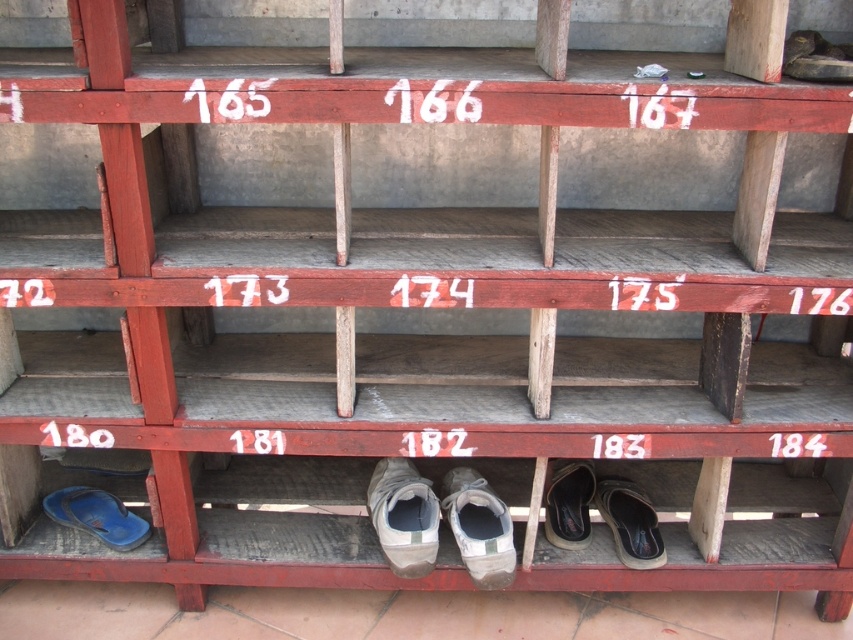
Does white fabric shoe at lower center have a larger size compared to black leather shoe at lower center?

Yes, white fabric shoe at lower center is bigger than black leather shoe at lower center.

Based on the photo, is white fabric shoe at lower center further to camera compared to black leather shoe at lower center?

No, white fabric shoe at lower center is closer to the viewer.

Is point (416, 563) positioned behind point (579, 496)?

No, it is in front of (579, 496).

Find the location of a particular element. white fabric shoe at lower center is located at coordinates (403, 516).

Does white fabric shoe at lower center appear on the left side of leather brown shoe at lower right?

Indeed, white fabric shoe at lower center is positioned on the left side of leather brown shoe at lower right.

Is point (428, 540) farther from viewer compared to point (613, 499)?

That is False.

Describe the element at coordinates (403, 516) in the screenshot. I see `white fabric shoe at lower center` at that location.

What are the coordinates of `white fabric shoe at lower center` in the screenshot? It's located at (403, 516).

Does blue rubber flip-flop at lower left appear under black leather shoe at lower center?

Indeed, blue rubber flip-flop at lower left is positioned under black leather shoe at lower center.

Who is more forward, (67, 520) or (572, 499)?

Positioned in front is point (67, 520).

Where is `blue rubber flip-flop at lower left`? The width and height of the screenshot is (853, 640). blue rubber flip-flop at lower left is located at coordinates (97, 515).